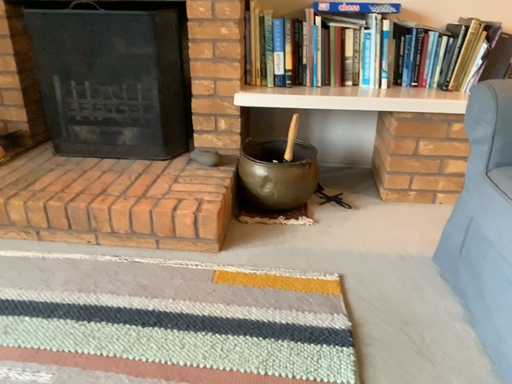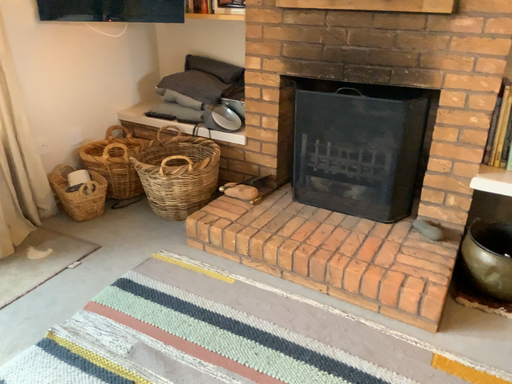
Question: How did the camera likely rotate when shooting the video?

Choices:
 (A) rotated left
 (B) rotated right

Answer: (A)